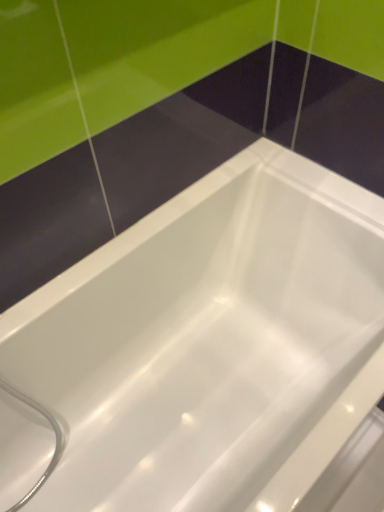
Measure the distance between white glossy bathtub at center and camera.

The distance of white glossy bathtub at center from camera is 29.30 inches.

At what (x,y) coordinates should I click in order to perform the action: click on white glossy bathtub at center. Please return your answer as a coordinate pair (x, y). Looking at the image, I should click on (211, 343).

This screenshot has width=384, height=512. What do you see at coordinates (211, 343) in the screenshot?
I see `white glossy bathtub at center` at bounding box center [211, 343].

What is the approximate height of white glossy bathtub at center?

white glossy bathtub at center is 24.34 inches tall.

You are a GUI agent. You are given a task and a screenshot of the screen. Output one action in this format:
    pyautogui.click(x=<x>, y=<y>)
    Task: Click on the white glossy bathtub at center
    This screenshot has height=512, width=384.
    Given the screenshot: What is the action you would take?
    211,343